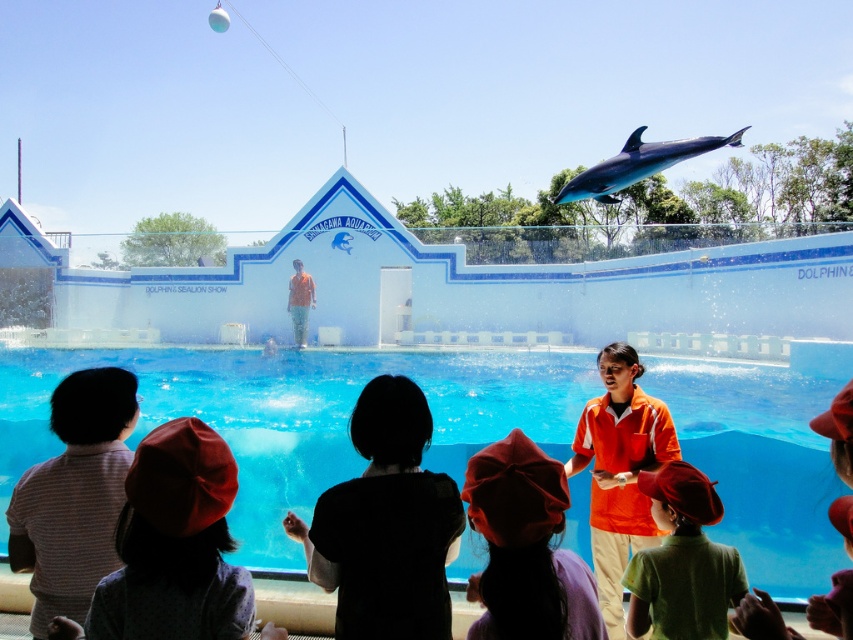
You are a photographer at the Shinagawa Aquarium dolphin show. You want to take a photo of the green matte shirt at lower center and the red fabric hat at lower center. Which object should you focus on first if you want to capture both in the same frame without moving the camera?

The red fabric hat at lower center is positioned on the left side of green matte shirt at lower center, so you should focus on the red fabric hat at lower center first to ensure both are in frame.

You are a visitor at the Shinagawa Aquarium and you want to take a photo of the dolphin show. You are standing at point (300, 416). Is there an obstacle blocking your view of the dolphin pool?

The transparent glass pool at center is located at point (300, 416), so there is no obstacle blocking your view of the dolphin pool.

You are a photographer at the Shinagawa Aquarium and want to capture a wide shot of the transparent glass pool at center and the red fabric hat at lower left. Which object should you focus on first if you want to ensure both are in frame without moving the camera?

The transparent glass pool at center is wider than the red fabric hat at lower left, so you should focus on the transparent glass pool at center first to ensure it fits within the frame, and the red fabric hat at lower left will automatically be included since it is narrower.